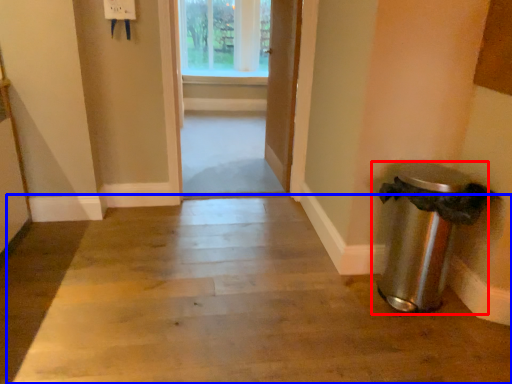
Question: Among these objects, which one is farthest to the camera, waste container (highlighted by a red box) or path (highlighted by a blue box)?

Choices:
 (A) waste container
 (B) path

Answer: (A)